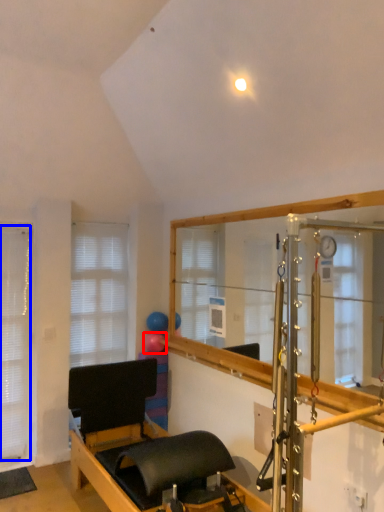
Question: Which object is closer to the camera taking this photo, balloon (highlighted by a red box) or blind (highlighted by a blue box)?

Choices:
 (A) balloon
 (B) blind

Answer: (B)